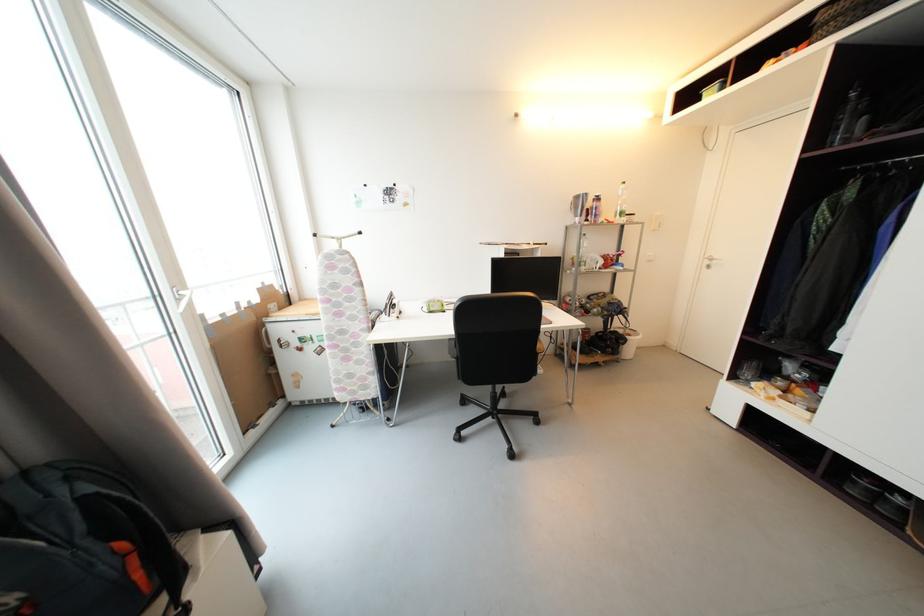
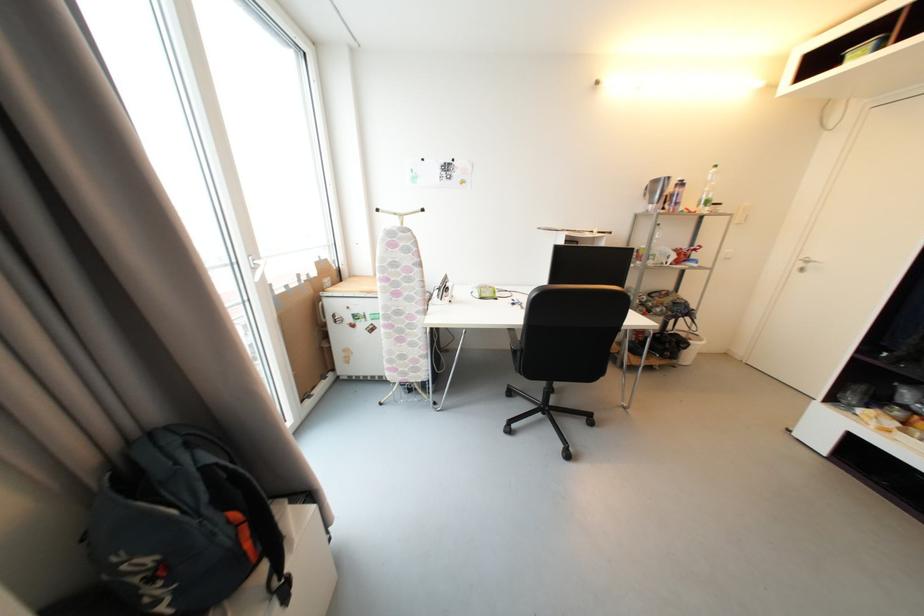
The point at (190, 291) is marked in the first image. Where is the corresponding point in the second image?

(264, 260)